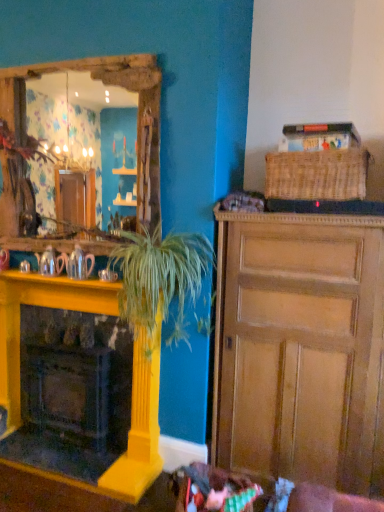
Question: Is matte silver teapot at left, arranged as the second teapot when viewed from the left, aimed at yellow painted wood fireplace at left?

Choices:
 (A) no
 (B) yes

Answer: (A)

Question: Considering the relative positions of matte silver teapot at left, arranged as the second teapot when viewed from the left, and yellow painted wood fireplace at left in the image provided, is matte silver teapot at left, arranged as the second teapot when viewed from the left, behind yellow painted wood fireplace at left?

Choices:
 (A) yes
 (B) no

Answer: (A)

Question: Does matte silver teapot at left, arranged as the second teapot when viewed from the left, have a larger size compared to yellow painted wood fireplace at left?

Choices:
 (A) no
 (B) yes

Answer: (A)

Question: Considering the relative positions of matte silver teapot at left, the 1th teapot when ordered from right to left, and yellow painted wood fireplace at left in the image provided, is matte silver teapot at left, the 1th teapot when ordered from right to left, to the right of yellow painted wood fireplace at left from the viewer's perspective?

Choices:
 (A) yes
 (B) no

Answer: (A)

Question: From the image's perspective, is matte silver teapot at left, the 1th teapot when ordered from right to left, on yellow painted wood fireplace at left?

Choices:
 (A) no
 (B) yes

Answer: (B)

Question: From a real-world perspective, is matte silver teapot at left, arranged as the second teapot when viewed from the left, positioned under yellow painted wood fireplace at left based on gravity?

Choices:
 (A) no
 (B) yes

Answer: (A)

Question: Can you confirm if matte silver coffee cup at lower left is bigger than matte silver teapot at left, the 1th teapot when ordered from right to left?

Choices:
 (A) no
 (B) yes

Answer: (A)

Question: Is matte silver coffee cup at lower left located outside matte silver teapot at left, arranged as the second teapot when viewed from the left?

Choices:
 (A) yes
 (B) no

Answer: (A)

Question: Is the position of matte silver coffee cup at lower left less distant than that of matte silver teapot at left, the 1th teapot when ordered from right to left?

Choices:
 (A) no
 (B) yes

Answer: (B)

Question: From a real-world perspective, is matte silver coffee cup at lower left over matte silver teapot at left, arranged as the second teapot when viewed from the left?

Choices:
 (A) no
 (B) yes

Answer: (A)

Question: From the image's perspective, is matte silver coffee cup at lower left located beneath matte silver teapot at left, the 1th teapot when ordered from right to left?

Choices:
 (A) yes
 (B) no

Answer: (A)

Question: Is matte silver coffee cup at lower left facing towards matte silver teapot at left, the 1th teapot when ordered from right to left?

Choices:
 (A) no
 (B) yes

Answer: (A)

Question: Is wooden cabinet at right to the left of shiny silver teapot at left, the 2th teapot from the right, from the viewer's perspective?

Choices:
 (A) yes
 (B) no

Answer: (B)